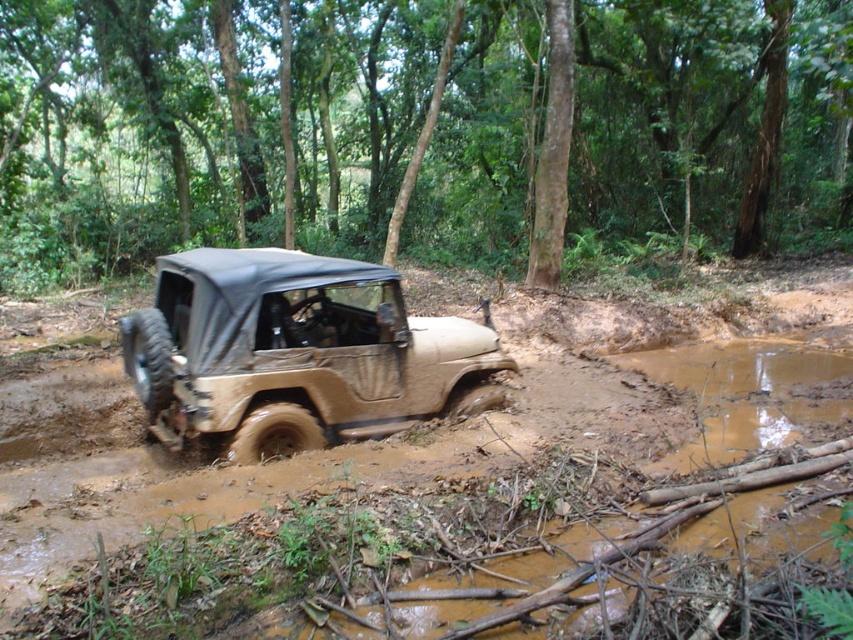
Question: Does brown matte vehicle at center have a smaller size compared to tan matte/sand textured jeep at center?

Choices:
 (A) no
 (B) yes

Answer: (A)

Question: Is the position of brown matte vehicle at center more distant than that of tan matte/sand textured jeep at center?

Choices:
 (A) no
 (B) yes

Answer: (B)

Question: Which point is closer to the camera?

Choices:
 (A) brown matte vehicle at center
 (B) tan matte/sand textured jeep at center

Answer: (B)

Question: Is brown matte vehicle at center behind tan matte/sand textured jeep at center?

Choices:
 (A) no
 (B) yes

Answer: (B)